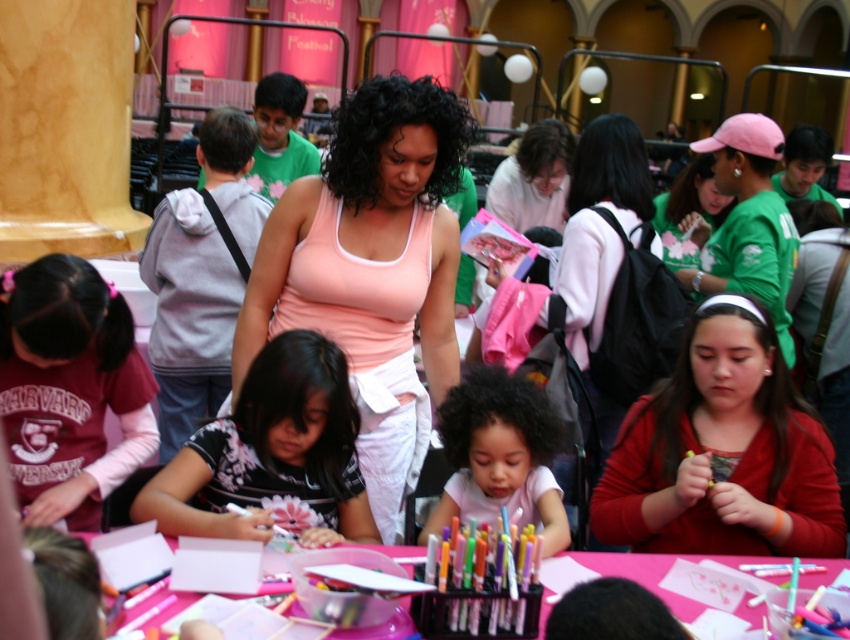
Does matte pink tank top at center appear on the right side of floral-patterned shirt at center?

Indeed, matte pink tank top at center is positioned on the right side of floral-patterned shirt at center.

Does matte pink tank top at center have a smaller size compared to floral-patterned shirt at center?

Actually, matte pink tank top at center might be larger than floral-patterned shirt at center.

Does point (765, 381) come behind point (292, 477)?

Yes.

The height and width of the screenshot is (640, 850). What are the coordinates of `matte pink tank top at center` in the screenshot? It's located at (722, 452).

Who is more distant from viewer, (60, 282) or (194, 596)?

Point (60, 282)

Does maroon fabric shirt at lower left appear on the right side of pink paper at center?

Incorrect, maroon fabric shirt at lower left is not on the right side of pink paper at center.

Which is in front, point (47, 401) or point (374, 547)?

Positioned in front is point (374, 547).

Identify the location of maroon fabric shirt at lower left. (69, 388).

Image resolution: width=850 pixels, height=640 pixels. What do you see at coordinates (372, 269) in the screenshot?
I see `pink fabric tank top at center` at bounding box center [372, 269].

Is pink fabric tank top at center positioned behind maroon fabric shirt at lower left?

Yes, it is.

Does point (355, 256) lie behind point (3, 422)?

Yes, it is.

Find the location of `pink fabric tank top at center`. pink fabric tank top at center is located at coordinates (372, 269).